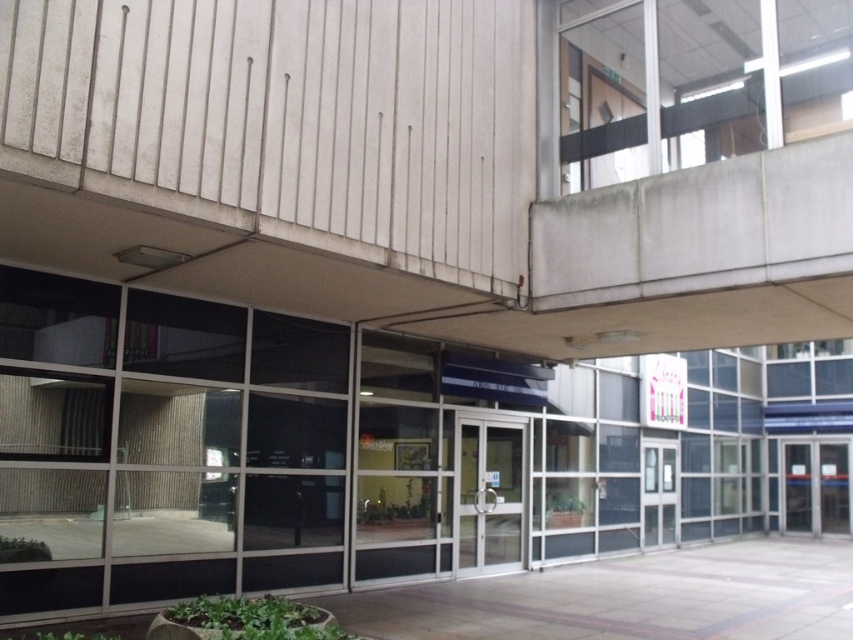
Can you confirm if transparent glass door at center is positioned below glass door at center?

Actually, transparent glass door at center is above glass door at center.

Who is more forward, (503, 428) or (654, 481)?

Point (503, 428) is more forward.

The image size is (853, 640). I want to click on transparent glass door at center, so click(489, 493).